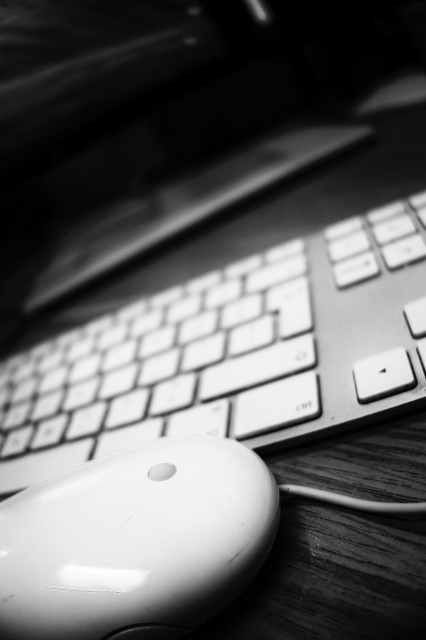
You are setting up a workspace and need to place both the white plastic keyboard at center and the white glossy mouse at lower left on a desk. If the desk has a width of 1 meter, and the mouse requires 10 cm of space, will both items fit side by side?

The white plastic keyboard at center is larger than the white glossy mouse at lower left. However, the exact dimensions are not provided. Assuming the keyboard takes up the remaining space after allocating 10 cm for the mouse, it would require 90 cm. Since 90 cm plus 10 cm equals 100 cm, which is exactly 1 meter, they can fit if the keyboard is exactly 90 cm wide. But without knowing the keyboard size, we can only say it might fit if the keyboard is within that limit.

You are trying to reach for the mouse while keeping your hand on the keyboard. Based on the image, which object is closer to you, the white plastic keyboard at center or the white glossy mouse at lower left?

The white glossy mouse at lower left is behind the white plastic keyboard at center, so the white plastic keyboard at center is closer to you.

You are setting up a new workspace and need to place a cup between the white plastic keyboard at center and the white glossy mouse at lower left. Based on their positions, where should you place the cup?

The white plastic keyboard at center is above the white glossy mouse at lower left, so you should place the cup between them either below the keyboard or above the mouse to ensure it is positioned correctly between both objects.